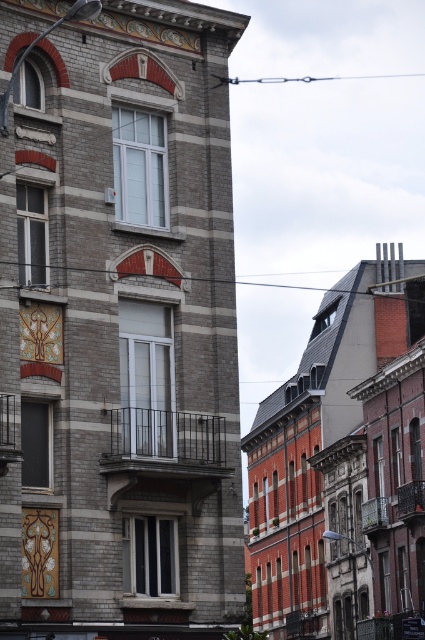
Question: Can you confirm if gold ornate clock at upper center is positioned to the left of gold metallic clock at upper center?

Choices:
 (A) no
 (B) yes

Answer: (B)

Question: Can you confirm if gold ornate clock at upper center is thinner than gold metallic clock at upper center?

Choices:
 (A) yes
 (B) no

Answer: (B)

Question: Among these objects, which one is nearest to the camera?

Choices:
 (A) gold metallic clock at upper center
 (B) gold ornate clock at upper center

Answer: (B)

Question: Is gold ornate clock at upper center closer to the viewer compared to gold metallic clock at upper center?

Choices:
 (A) yes
 (B) no

Answer: (A)